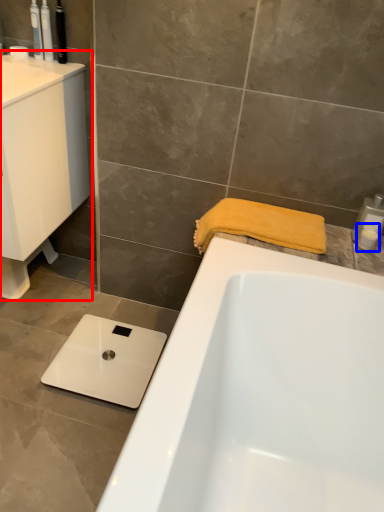
Question: Which point is further to the camera, sink (highlighted by a red box) or toiletry (highlighted by a blue box)?

Choices:
 (A) sink
 (B) toiletry

Answer: (B)